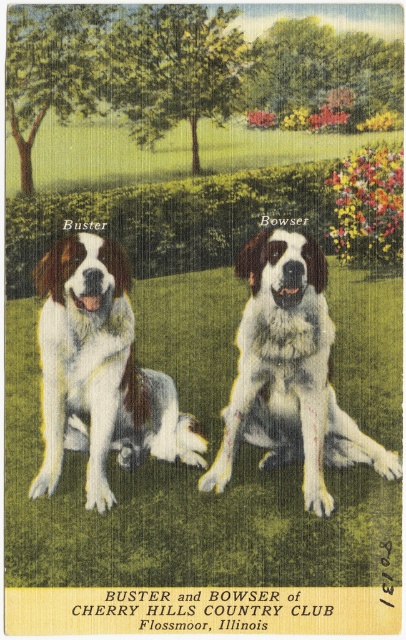
You are a dog trainer assessing the health of two Saint Bernard dogs in the image. The dogs are labeled as the white fur dog at center and the white fur saint bernard at center. Which dog has a more slender build?

The white fur dog at center is thinner than the white fur saint bernard at center, so the white fur dog at center has a more slender build.

You are a dog owner who wants to ensure both dogs have enough space to lie down comfortably. Given that the white fur dog at center requires a minimum of 1.2 meters of space and the white fur saint bernard at center needs at least 1.5 meters, can you determine which dog requires more space based on their sizes?

The white fur saint bernard at center requires more space since it is taller than the white fur dog at center, and therefore needs the 1.5 meters of space.

You are a photographer trying to capture the two dogs in the image. You notice that the white fur dog at center and the white fur saint bernard at center are positioned in a way that might block each other. Based on their positions, which dog is lower in the image?

The white fur dog at center is positioned below the white fur saint bernard at center, so the white fur dog at center is lower in the image.